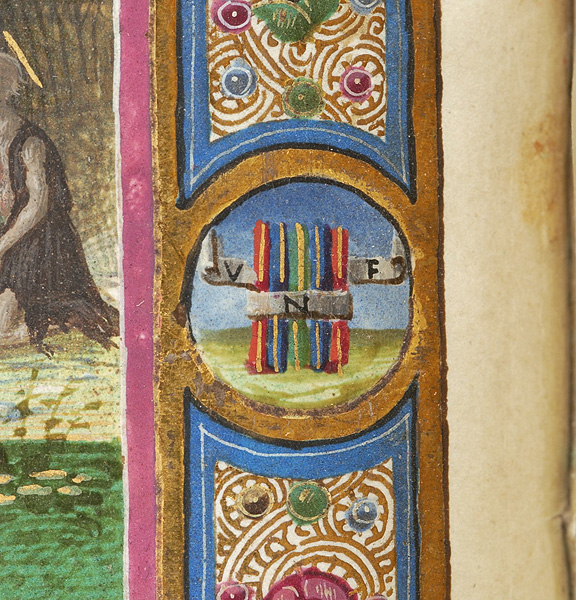
Image resolution: width=576 pixels, height=600 pixels. I want to click on yellow paint, so click(x=67, y=406).